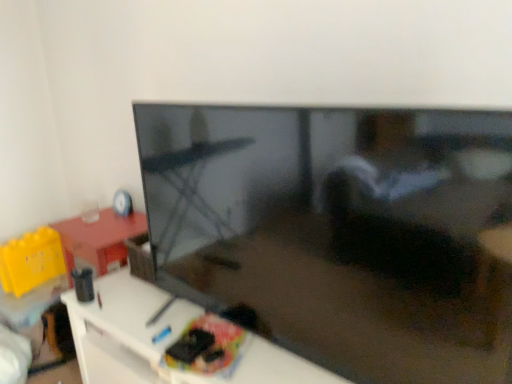
Identify the location of free spot above white glossy tv stand at lower left (from a real-world perspective). The height and width of the screenshot is (384, 512). (186, 324).